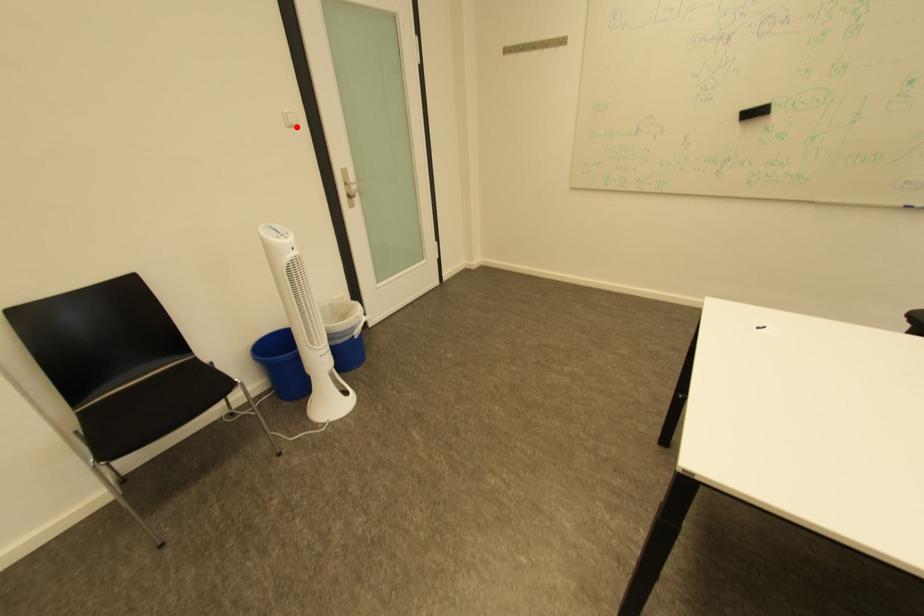
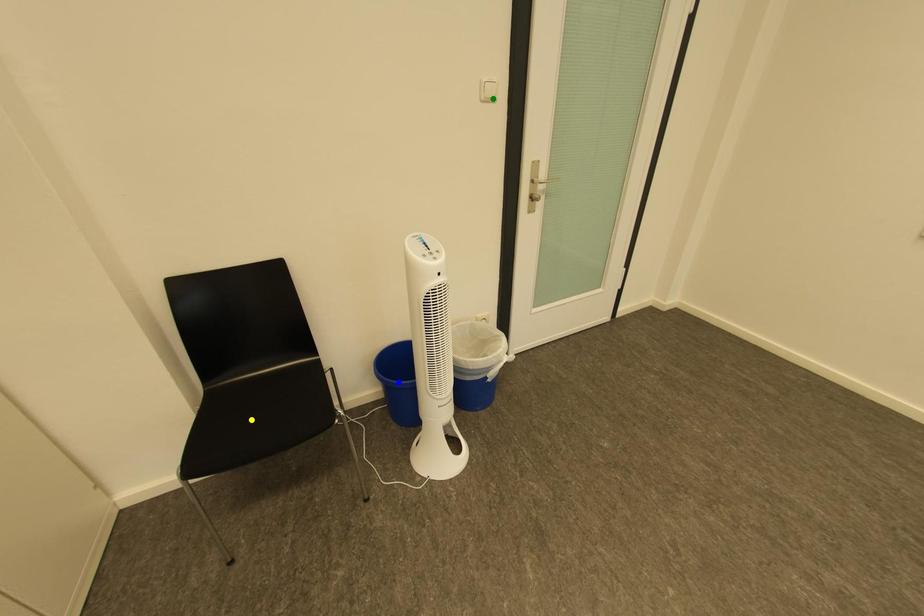
Question: I am providing you with two images of the same scene from different viewpoints. A red point is marked on the first image. You are given multiple points on the second image. Which mark in image 2 goes with the point in image 1?

Choices:
 (A) yellow point
 (B) green point
 (C) blue point

Answer: (B)